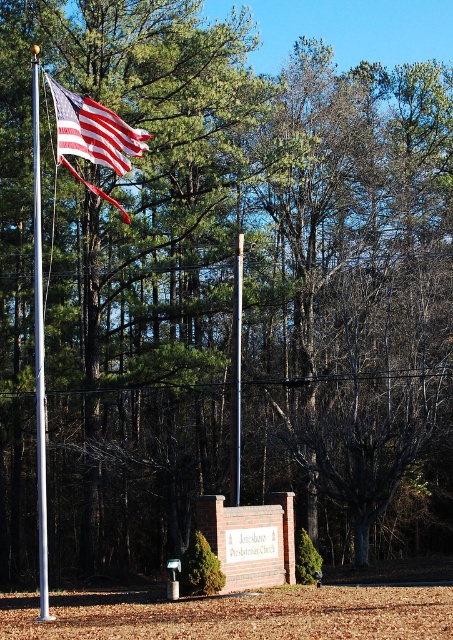
Question: Is american flag at left smaller than polished metal flag pole at left?

Choices:
 (A) yes
 (B) no

Answer: (A)

Question: Which object is farther from the camera taking this photo?

Choices:
 (A) american flag at left
 (B) polished metal flag pole at left

Answer: (A)

Question: Is american flag at left below polished metal flag pole at left?

Choices:
 (A) no
 (B) yes

Answer: (A)

Question: Which of the following is the closest to the observer?

Choices:
 (A) polished metal flag pole at left
 (B) american flag at left

Answer: (A)

Question: Is the position of american flag at left less distant than that of polished metal flag pole at left?

Choices:
 (A) yes
 (B) no

Answer: (B)